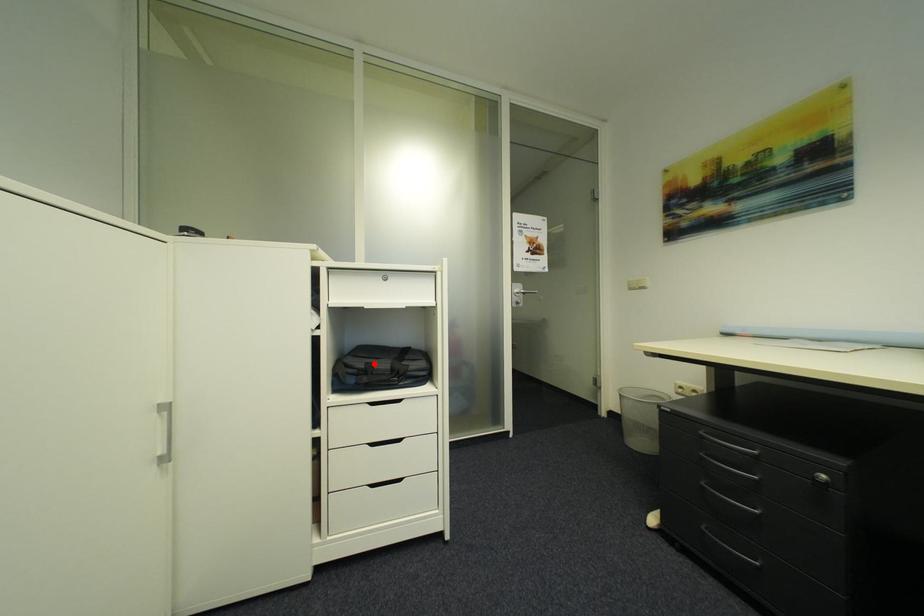
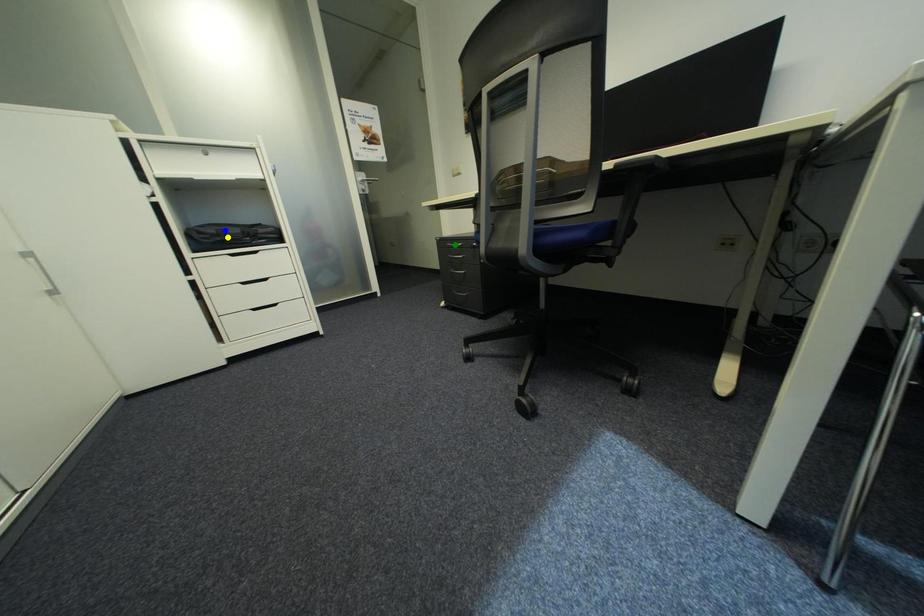
Question: I am providing you with two images of the same scene from different viewpoints. A red point is marked on the first image. You are given multiple points on the second image. Can you choose the point in image 2 that corresponds to the point in image 1?

Choices:
 (A) blue point
 (B) yellow point
 (C) green point

Answer: (A)